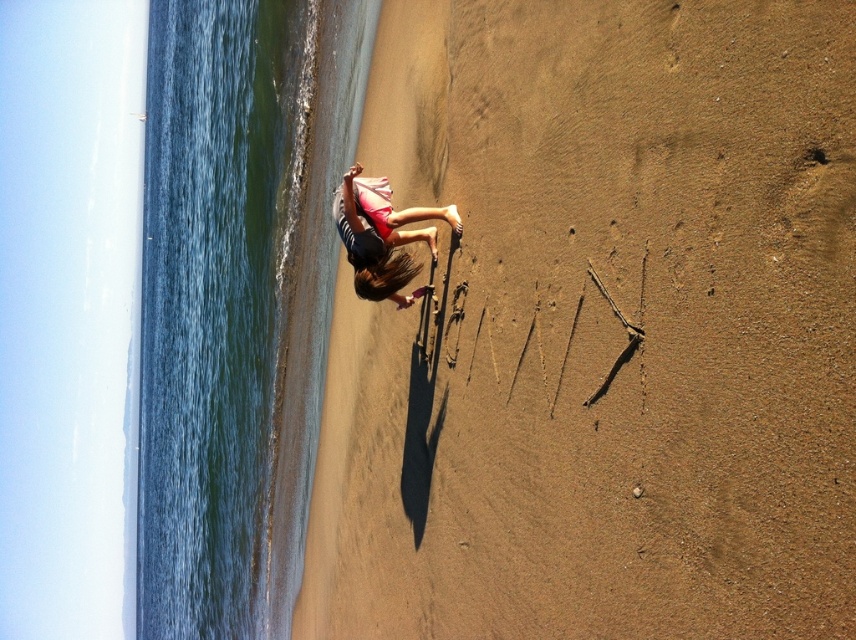
Is blue water at left further to the viewer compared to matte pink shorts at center?

Yes, blue water at left is behind matte pink shorts at center.

Can you confirm if blue water at left is bigger than matte pink shorts at center?

Yes, blue water at left is bigger than matte pink shorts at center.

Does point (195, 390) come farther from viewer compared to point (375, 250)?

Yes, point (195, 390) is behind point (375, 250).

This screenshot has height=640, width=856. In order to click on blue water at left in this screenshot , I will do `click(217, 304)`.

Locate an element on the screen. This screenshot has width=856, height=640. brown sandy beach at lower right is located at coordinates (602, 330).

Can you confirm if brown sandy beach at lower right is positioned above blue water at left?

Correct, brown sandy beach at lower right is located above blue water at left.

Identify the location of brown sandy beach at lower right. This screenshot has width=856, height=640. (602, 330).

This screenshot has width=856, height=640. In order to click on brown sandy beach at lower right in this screenshot , I will do `click(602, 330)`.

Is brown sandy beach at lower right thinner than matte pink shorts at center?

In fact, brown sandy beach at lower right might be wider than matte pink shorts at center.

Is brown sandy beach at lower right positioned at the back of matte pink shorts at center?

No.

Which is behind, point (480, 257) or point (376, 221)?

Point (376, 221)

Image resolution: width=856 pixels, height=640 pixels. Find the location of `brown sandy beach at lower right`. brown sandy beach at lower right is located at coordinates (602, 330).